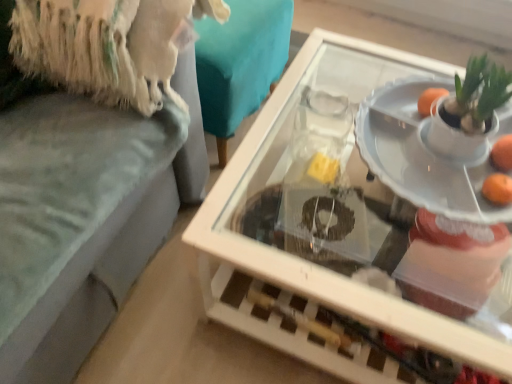
The image size is (512, 384). Find the location of `vacant space behind orange matte at right, placed as the 2th orange when sorted from top to bottom`. vacant space behind orange matte at right, placed as the 2th orange when sorted from top to bottom is located at coordinates (452, 152).